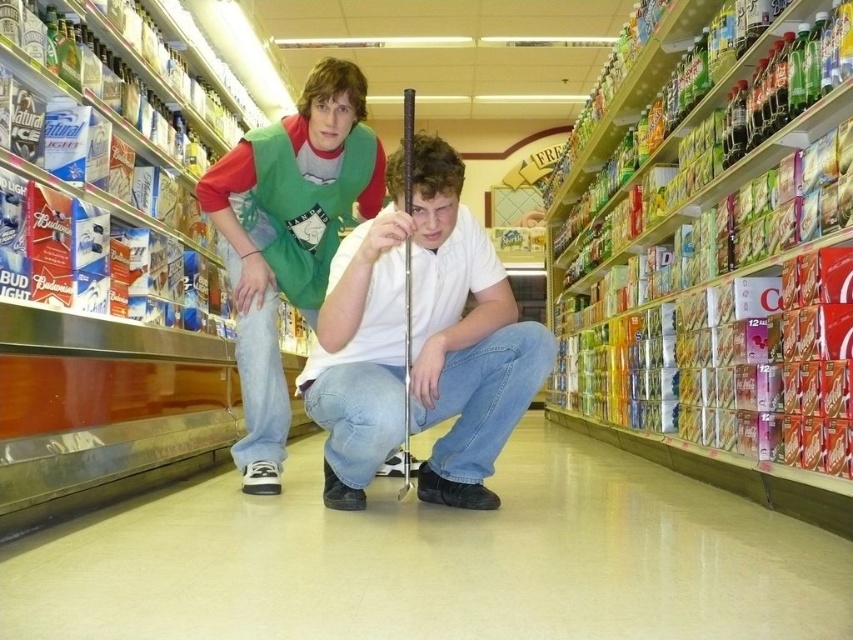
You are a store employee who needs to reach a customer wearing a white matte shirt at center. You are currently standing 1.2 meters away from the entrance. Is the customer within your immediate vicinity?

The white matte shirt at center is 1.57 meters away from the viewer. Since you are 1.2 meters away from the entrance, the customer is within your immediate vicinity as the distance between you and the customer is less than 2 meters.

You are a store employee who needs to hang a sign on the wall between the white matte shirt at center and the green fabric vest at center. Which object should you place the sign closer to if the sign is 1.2 meters tall?

The white matte shirt at center is shorter than the green fabric vest at center, so the sign should be placed closer to the white matte shirt at center to ensure it is at an appropriate height for both.